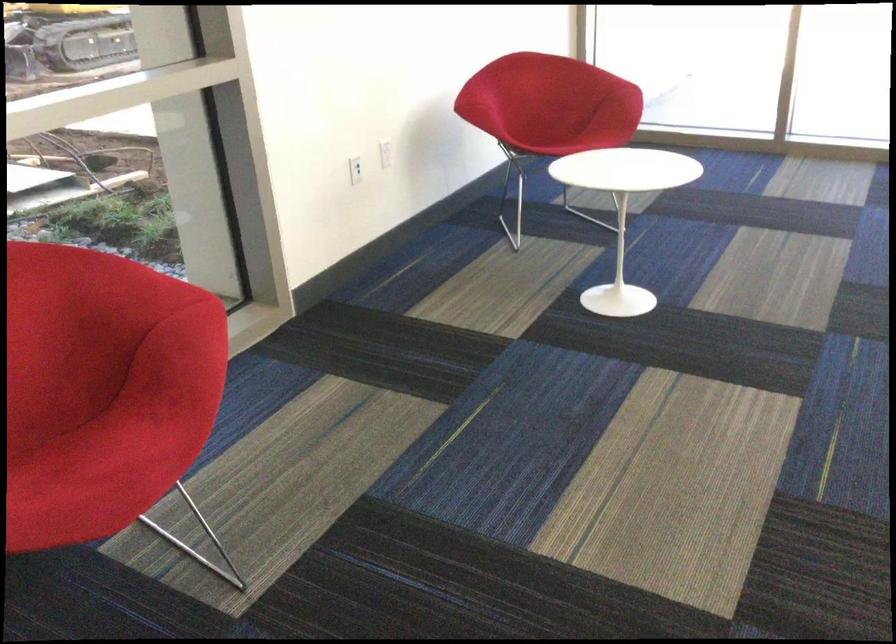
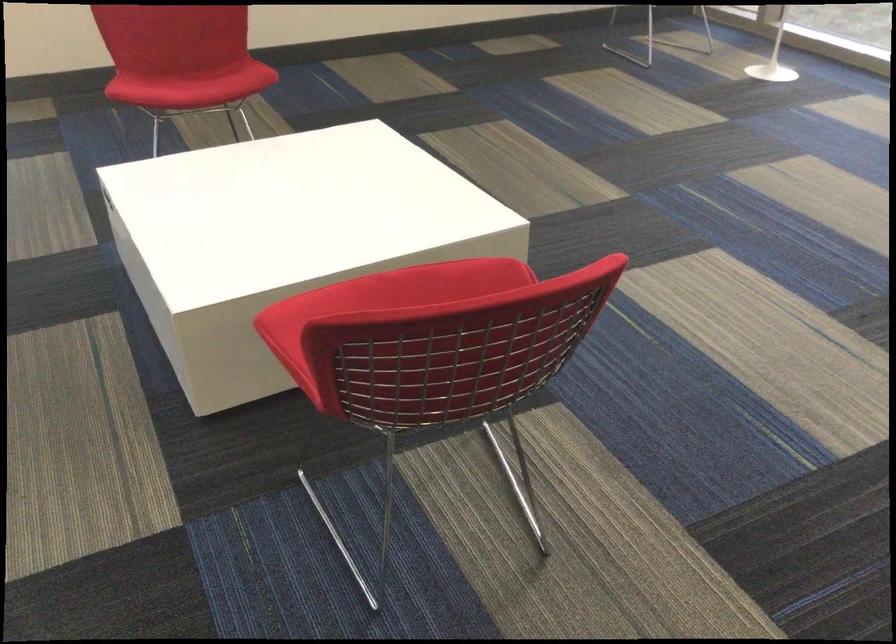
Question: The first image is from the beginning of the video and the second image is from the end. How did the camera likely rotate when shooting the video?

Choices:
 (A) Left
 (B) Right
 (C) Up
 (D) Down

Answer: (B)